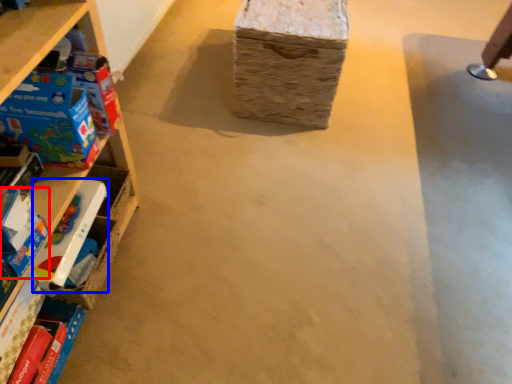
Question: Which object appears closest to the camera in this image, toy (highlighted by a red box) or toy (highlighted by a blue box)?

Choices:
 (A) toy
 (B) toy

Answer: (A)